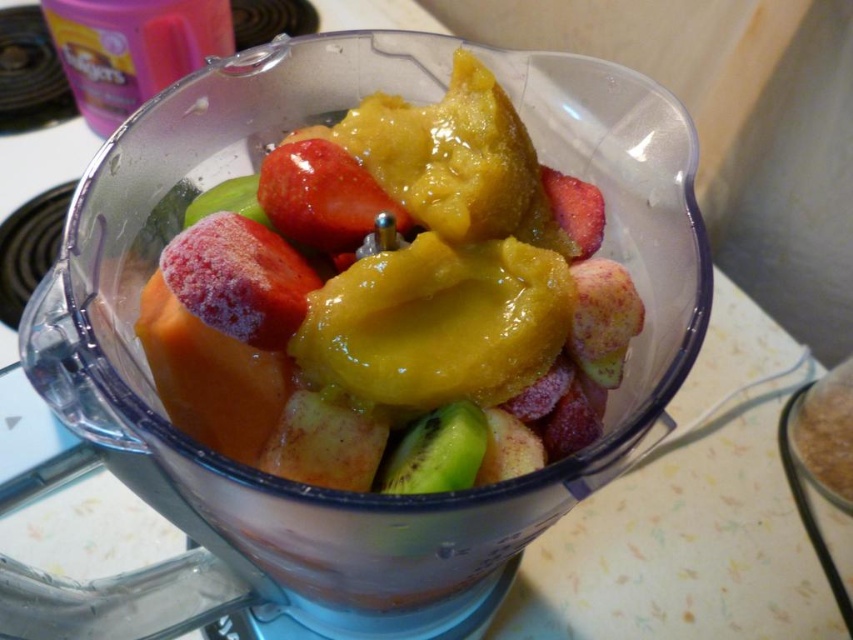
Is glossy plastic blender at center further to the viewer compared to green matte kiwi at center?

Yes.

Is glossy plastic blender at center below green matte kiwi at center?

Actually, glossy plastic blender at center is above green matte kiwi at center.

What do you see at coordinates (390, 291) in the screenshot? The height and width of the screenshot is (640, 853). I see `glossy plastic blender at center` at bounding box center [390, 291].

Locate an element on the screen. This screenshot has width=853, height=640. glossy plastic blender at center is located at coordinates (390, 291).

Does glossy plastic blender at center appear under shiny red strawberry at center?

Yes, glossy plastic blender at center is below shiny red strawberry at center.

Image resolution: width=853 pixels, height=640 pixels. I want to click on glossy plastic blender at center, so click(x=390, y=291).

Identify the location of glossy plastic blender at center. (390, 291).

Which is above, shiny red strawberry at center or green matte kiwi at center?

shiny red strawberry at center is above.

Is shiny red strawberry at center further to camera compared to green matte kiwi at center?

That is True.

Does point (355, 204) come behind point (426, 483)?

Yes, point (355, 204) is behind point (426, 483).

Locate an element on the screen. Image resolution: width=853 pixels, height=640 pixels. shiny red strawberry at center is located at coordinates (322, 196).